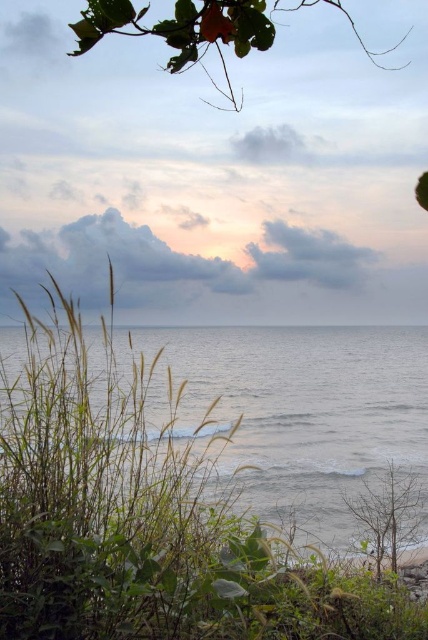
Question: Can you confirm if gray matte water at center is positioned above green leafy branch at upper center?

Choices:
 (A) no
 (B) yes

Answer: (A)

Question: Where is gray matte water at center located in relation to green leafy branch at upper center in the image?

Choices:
 (A) below
 (B) above

Answer: (A)

Question: Among these objects, which one is nearest to the camera?

Choices:
 (A) green leafy branch at upper center
 (B) gray matte water at center

Answer: (A)

Question: Among these objects, which one is farthest from the camera?

Choices:
 (A) gray matte water at center
 (B) green leafy branch at upper center

Answer: (A)

Question: Is gray matte water at center wider than green leafy branch at upper center?

Choices:
 (A) no
 (B) yes

Answer: (B)